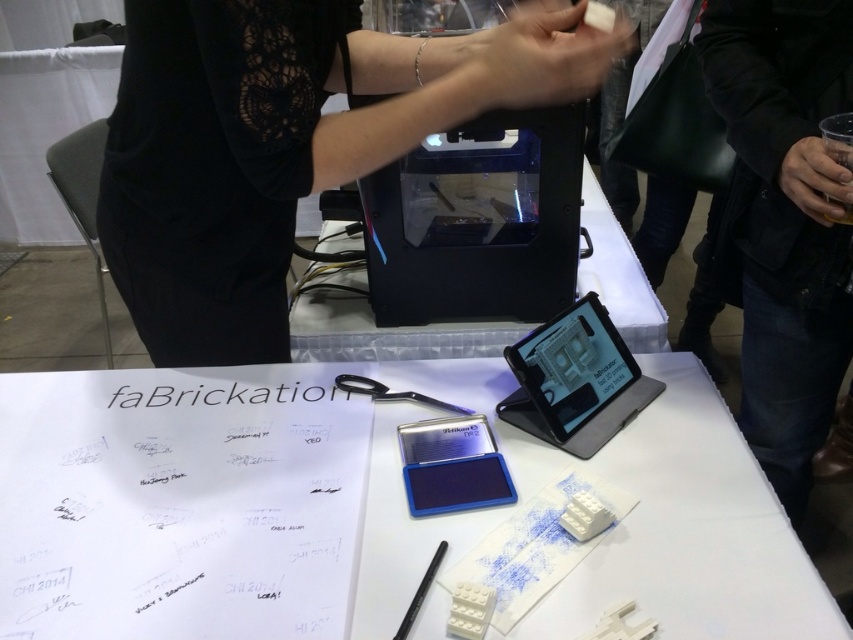
Question: Can you confirm if black lace shirt at upper center is positioned below black plastic pen at lower center?

Choices:
 (A) yes
 (B) no

Answer: (B)

Question: Is black plastic printer at center thinner than black plastic pen at lower center?

Choices:
 (A) yes
 (B) no

Answer: (B)

Question: Is brown leather jacket at upper right wider than black plastic pen at lower center?

Choices:
 (A) yes
 (B) no

Answer: (A)

Question: Which point is closer to the camera taking this photo?

Choices:
 (A) (746, 268)
 (B) (404, 182)

Answer: (A)

Question: Among these points, which one is farthest from the camera?

Choices:
 (A) (476, 452)
 (B) (349, 355)
 (C) (722, 38)
 (D) (260, 17)

Answer: (B)

Question: Estimate the real-world distances between objects in this image. Which object is closer to the metallic scissors at center?

Choices:
 (A) white matte paper at center
 (B) transparent plastic printer at center

Answer: (A)